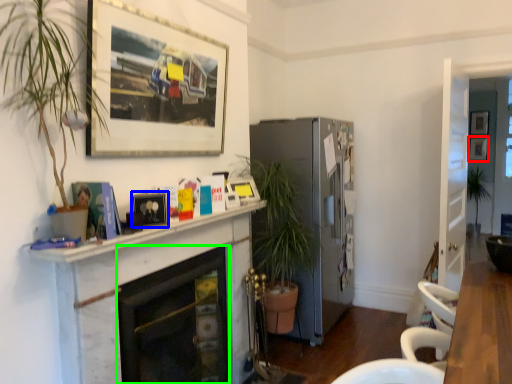
Question: Considering the real-world distances, which object is farthest from picture frame (highlighted by a red box)? picture frame (highlighted by a blue box) or fireplace (highlighted by a green box)?

Choices:
 (A) picture frame
 (B) fireplace

Answer: (A)